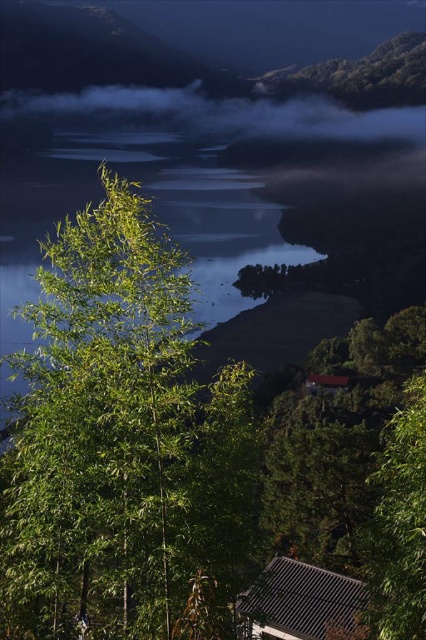
Between point (85, 291) and point (331, 577), which one is positioned in front?

Point (85, 291) is more forward.

Measure the distance between green leafy tree at left and gray corrugated metal hut at lower center.

38.47 feet

The image size is (426, 640). I want to click on green leafy tree at left, so (123, 445).

Locate an element on the screen. This screenshot has height=640, width=426. green leafy tree at left is located at coordinates (123, 445).

Who is shorter, gray corrugated metal hut at lower center or brown wooden hut at center-right?

Standing shorter between the two is brown wooden hut at center-right.

Measure the distance between gray corrugated metal hut at lower center and camera.

gray corrugated metal hut at lower center and camera are 12.56 meters apart.

What are the coordinates of `gray corrugated metal hut at lower center` in the screenshot? It's located at tap(302, 602).

Locate an element on the screen. The height and width of the screenshot is (640, 426). gray corrugated metal hut at lower center is located at coordinates (302, 602).

Based on the photo, does green leafy tree at right appear on the left side of gray corrugated metal hut at lower center?

Incorrect, green leafy tree at right is not on the left side of gray corrugated metal hut at lower center.

Who is positioned more to the right, green leafy tree at right or gray corrugated metal hut at lower center?

From the viewer's perspective, green leafy tree at right appears more on the right side.

The height and width of the screenshot is (640, 426). In order to click on green leafy tree at right in this screenshot , I will do `click(399, 522)`.

Where is `green leafy tree at right`? This screenshot has width=426, height=640. green leafy tree at right is located at coordinates (399, 522).